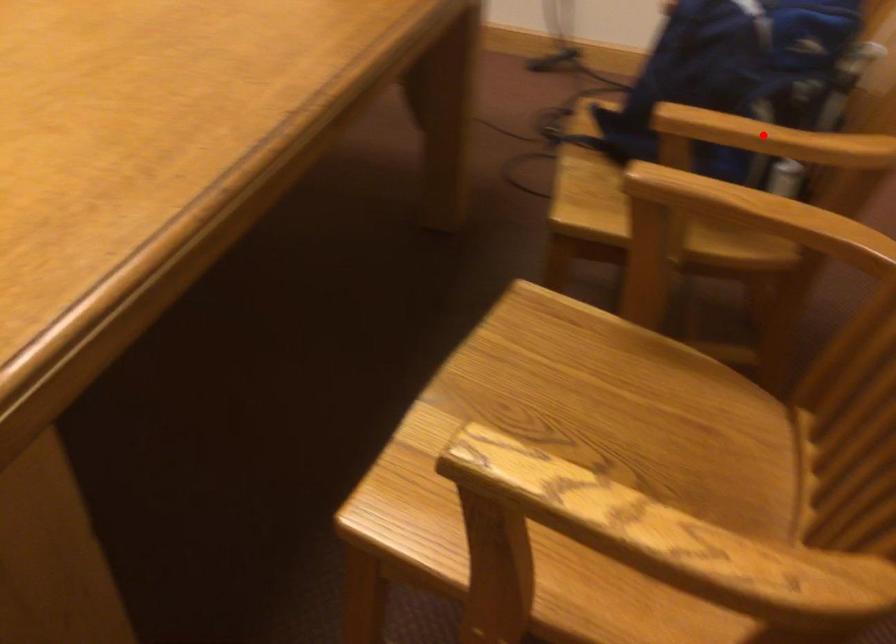
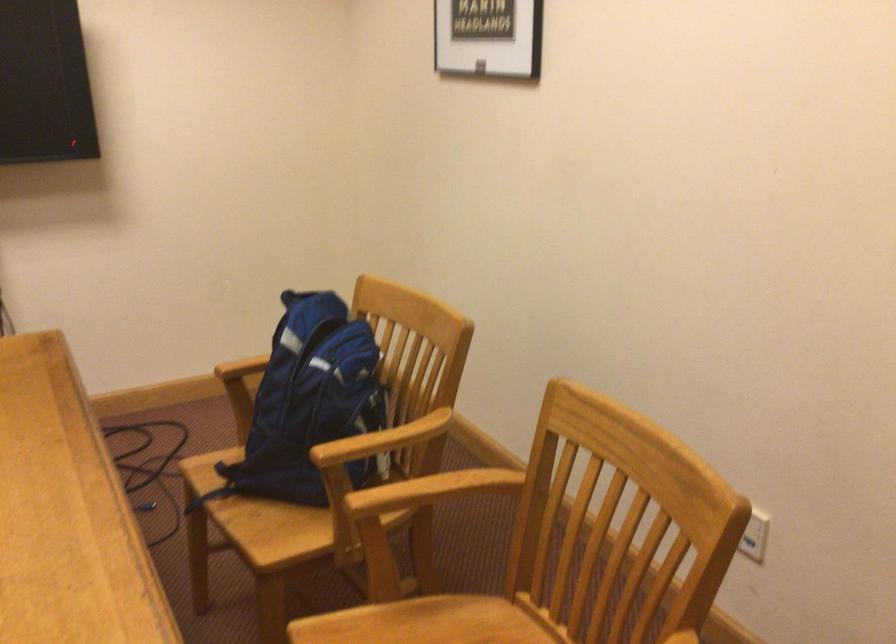
Question: A red point is marked in image1. In image2, is the corresponding 3D point closer to the camera or farther? Reply with the corresponding letter.

Choices:
 (A) The corresponding 3D point is closer.
 (B) The corresponding 3D point is farther.

Answer: (B)